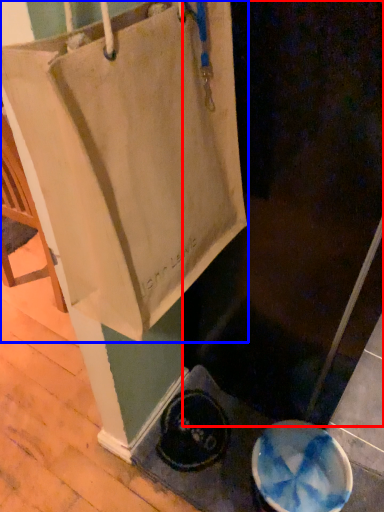
Question: Among these objects, which one is farthest to the camera, screen door (highlighted by a red box) or tote bag (highlighted by a blue box)?

Choices:
 (A) screen door
 (B) tote bag

Answer: (A)